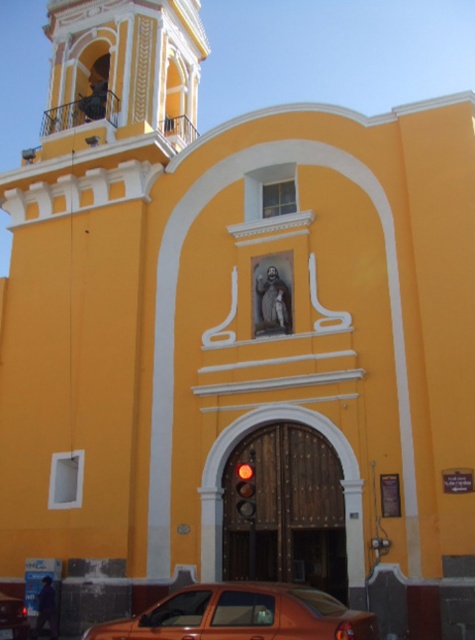
Question: Where is orange metallic car at lower center located in relation to orange matte car at lower left in the image?

Choices:
 (A) below
 (B) above

Answer: (B)

Question: Does orange metallic car at lower center have a lesser width compared to orange matte car at lower left?

Choices:
 (A) no
 (B) yes

Answer: (A)

Question: Is orange metallic car at lower center above orange matte car at lower left?

Choices:
 (A) no
 (B) yes

Answer: (B)